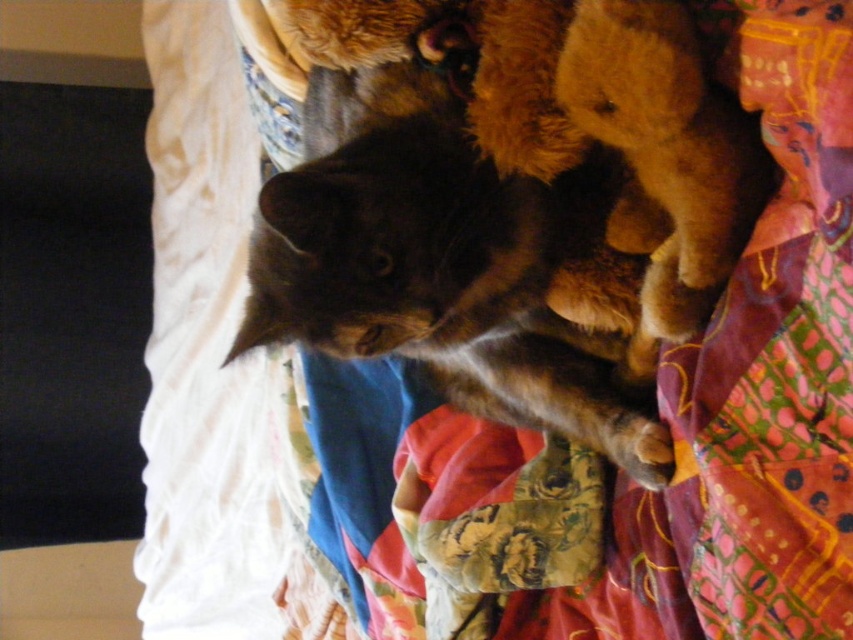
Question: Which of the following is the closest to the observer?

Choices:
 (A) (654, 294)
 (B) (283, 276)

Answer: (A)

Question: Can you confirm if dark brown fur cat at center is wider than soft brown teddy bear at upper right?

Choices:
 (A) no
 (B) yes

Answer: (B)

Question: Which of the following is the closest to the observer?

Choices:
 (A) (483, 221)
 (B) (665, 102)

Answer: (B)

Question: Is dark brown fur cat at center smaller than soft brown teddy bear at upper right?

Choices:
 (A) yes
 (B) no

Answer: (B)

Question: Considering the relative positions of dark brown fur cat at center and soft brown teddy bear at upper right in the image provided, where is dark brown fur cat at center located with respect to soft brown teddy bear at upper right?

Choices:
 (A) below
 (B) above

Answer: (A)

Question: Among these points, which one is farthest from the camera?

Choices:
 (A) (717, 220)
 (B) (263, 186)

Answer: (B)